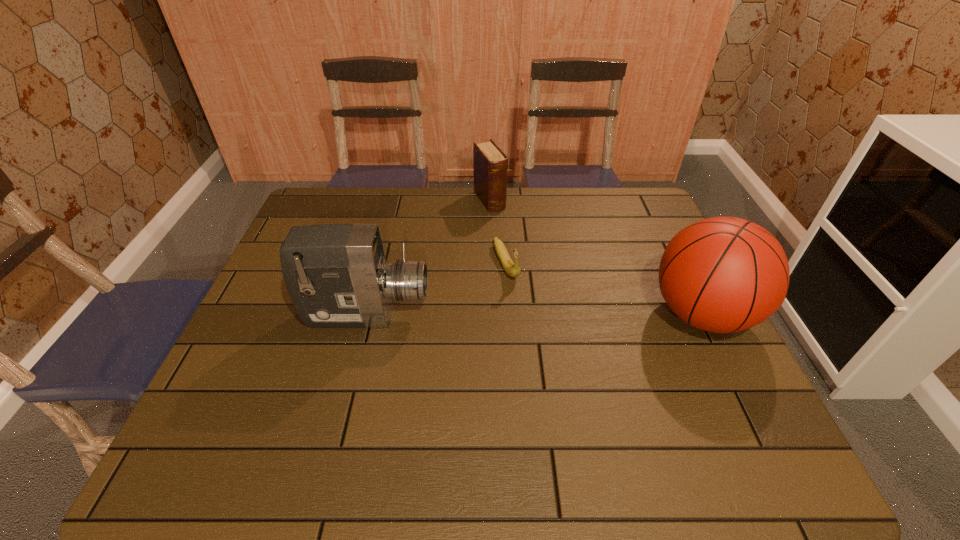
Where is `free space between the leftmost object and the banana`? This screenshot has height=540, width=960. free space between the leftmost object and the banana is located at coordinates (437, 289).

Locate an element on the screen. The width and height of the screenshot is (960, 540). empty location between the basketball and the leftmost object is located at coordinates (534, 314).

I want to click on the closest object relative to the camcorder, so click(512, 269).

Identify which object is the second closest to the second shortest object. Please provide its 2D coordinates. Your answer should be formatted as a tuple, i.e. [(x, y)], where the tuple contains the x and y coordinates of a point satisfying the conditions above.

[(337, 276)]

Locate an element on the screen. Image resolution: width=960 pixels, height=540 pixels. vacant space that satisfies the following two spatial constraints: 1. on the front side of the basketball; 2. on the left side of the diary is located at coordinates click(492, 314).

This screenshot has width=960, height=540. What are the coordinates of `free spot that satisfies the following two spatial constraints: 1. on the front side of the shortest object; 2. on the left side of the rightmost object` in the screenshot? It's located at (510, 314).